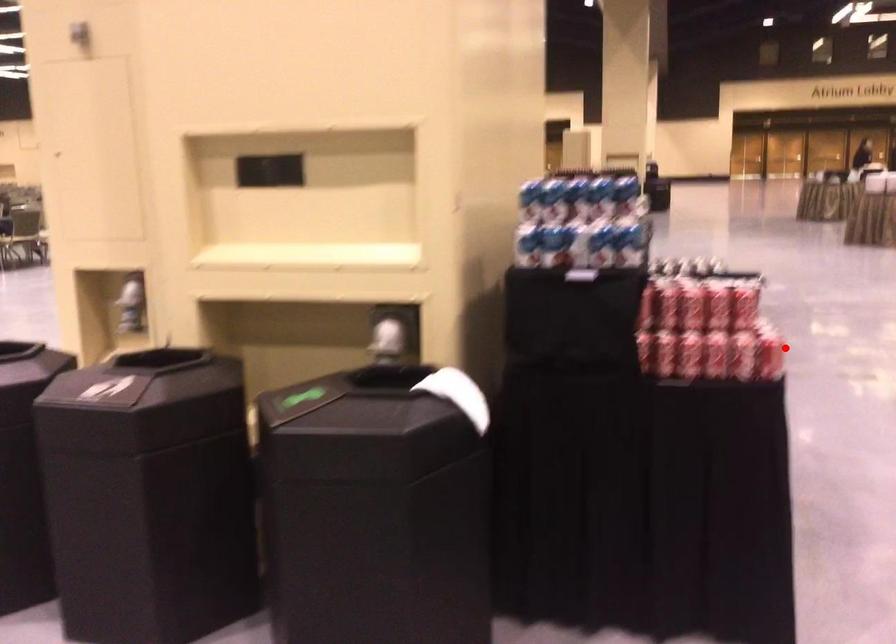
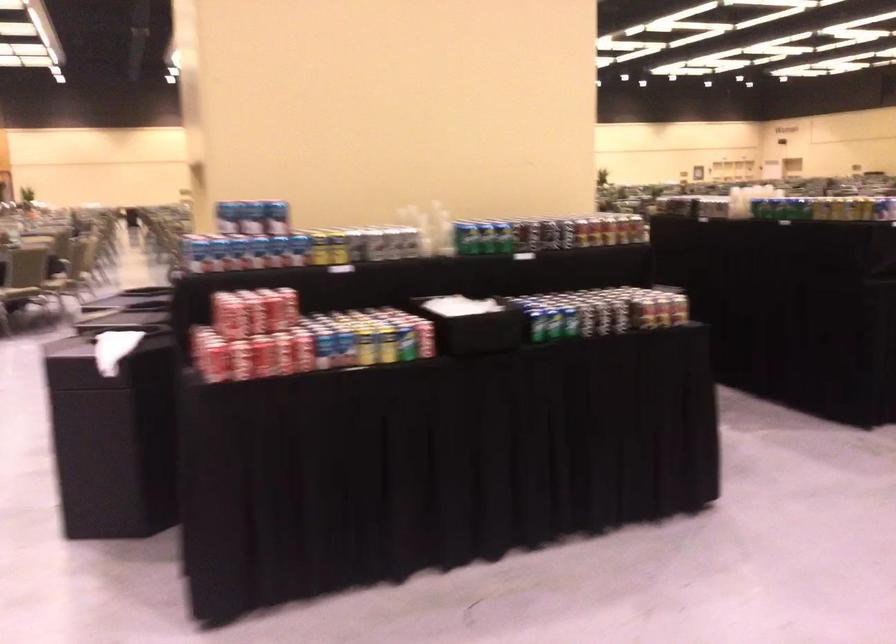
In the second image, find the point that corresponds to the highlighted location in the first image.

(240, 360)